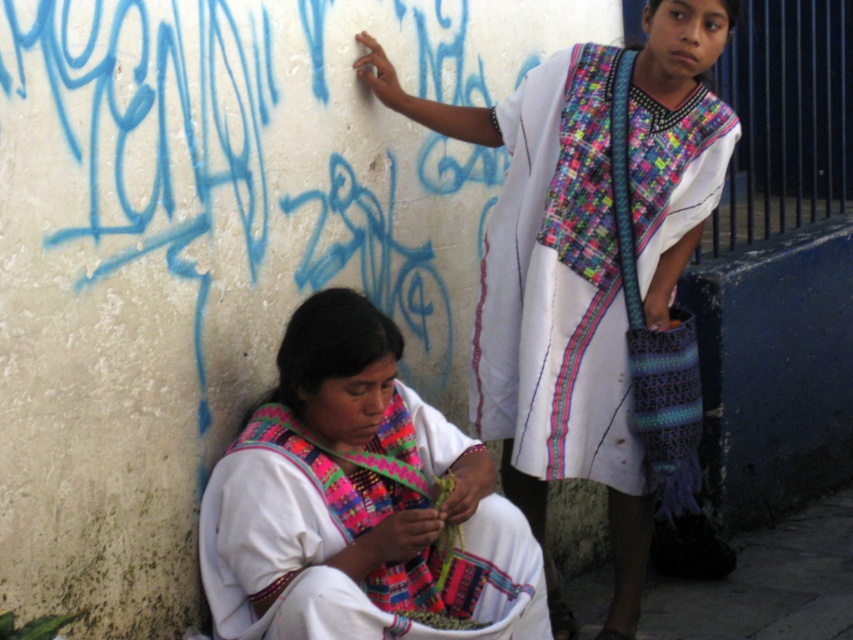
Question: Is white woven fabric dress at upper center below matte white shawl at lower left?

Choices:
 (A) yes
 (B) no

Answer: (B)

Question: Can you confirm if white woven fabric dress at upper center is positioned below matte white shawl at lower left?

Choices:
 (A) no
 (B) yes

Answer: (A)

Question: Which point is farther to the camera?

Choices:
 (A) (619, 294)
 (B) (434, 472)

Answer: (A)

Question: Considering the relative positions of white woven fabric dress at upper center and matte white shawl at lower left in the image provided, where is white woven fabric dress at upper center located with respect to matte white shawl at lower left?

Choices:
 (A) above
 (B) below

Answer: (A)